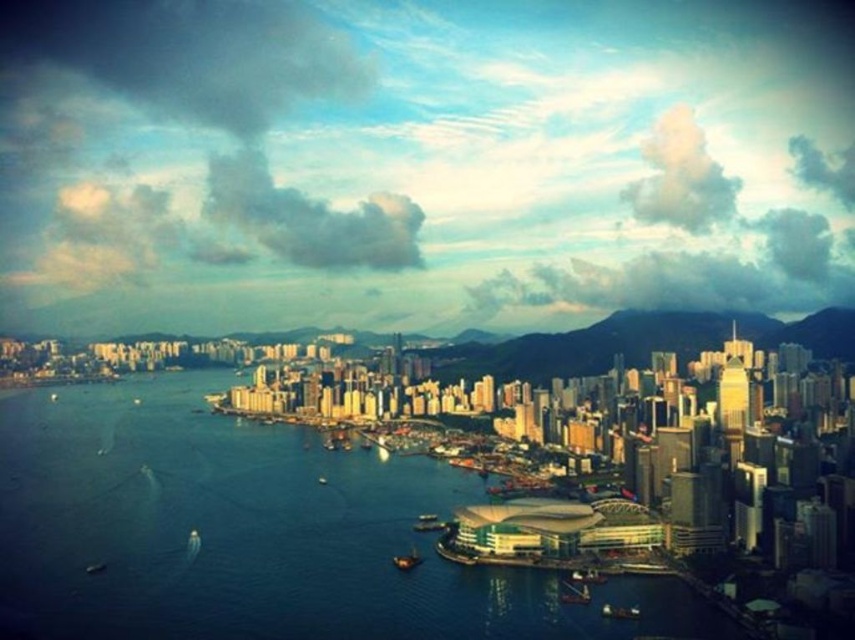
Does blue water at center have a smaller size compared to metallic gray boat at lower center?

Incorrect, blue water at center is not smaller in size than metallic gray boat at lower center.

The width and height of the screenshot is (855, 640). What do you see at coordinates (258, 532) in the screenshot? I see `blue water at center` at bounding box center [258, 532].

Identify the location of blue water at center. The image size is (855, 640). (258, 532).